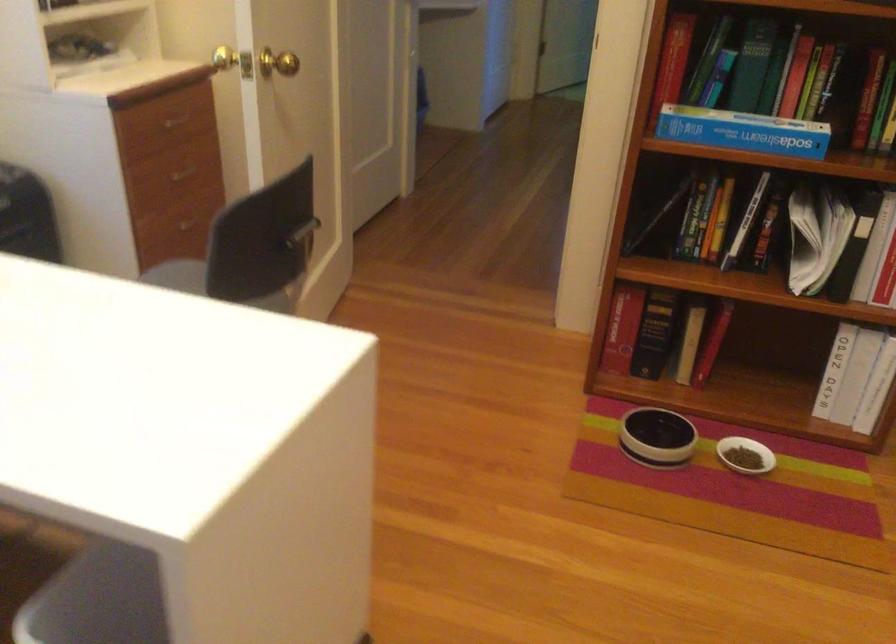
Identify the location of chair sitting surface. The height and width of the screenshot is (644, 896). (177, 275).